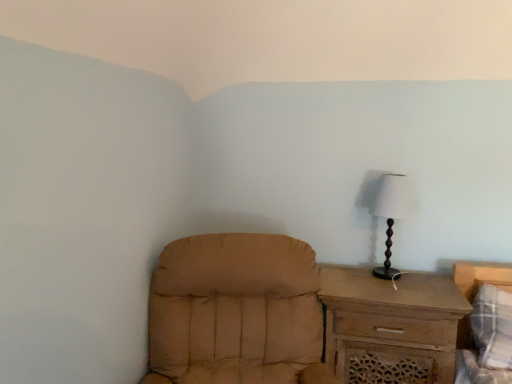
At what (x,y) coordinates should I click in order to perform the action: click on tan fabric chair at lower left. Please return your answer as a coordinate pair (x, y). Looking at the image, I should click on (236, 312).

The height and width of the screenshot is (384, 512). What do you see at coordinates (481, 276) in the screenshot?
I see `plaid fabric bed at lower right` at bounding box center [481, 276].

Identify the location of tan fabric chair at lower left. (236, 312).

Which is in front, point (384, 175) or point (475, 266)?

Point (475, 266)

Based on their positions, is white fabric lampshade at right located to the left or right of plaid fabric bed at lower right?

Based on their positions, white fabric lampshade at right is located to the left of plaid fabric bed at lower right.

Is white fabric lampshade at right touching plaid fabric bed at lower right?

No, white fabric lampshade at right is not touching plaid fabric bed at lower right.

In terms of size, does white fabric lampshade at right appear bigger or smaller than plaid fabric bed at lower right?

Considering their sizes, white fabric lampshade at right takes up less space than plaid fabric bed at lower right.

Choose the correct answer: Is brown wooden chest of drawers at right inside white fabric lampshade at right or outside it?

brown wooden chest of drawers at right is located beyond the bounds of white fabric lampshade at right.

Does brown wooden chest of drawers at right appear on the right side of white fabric lampshade at right?

Incorrect, brown wooden chest of drawers at right is not on the right side of white fabric lampshade at right.

What's the angular difference between brown wooden chest of drawers at right and white fabric lampshade at right's facing directions?

The angular difference between brown wooden chest of drawers at right and white fabric lampshade at right is 0.385 degrees.

From a real-world perspective, is brown wooden chest of drawers at right on top of white fabric lampshade at right?

No.

Is plaid fabric bed at lower right at the left side of brown wooden chest of drawers at right?

In fact, plaid fabric bed at lower right is to the right of brown wooden chest of drawers at right.

Can brown wooden chest of drawers at right be found inside plaid fabric bed at lower right?

No, brown wooden chest of drawers at right is not inside plaid fabric bed at lower right.

Which of these two, plaid fabric bed at lower right or brown wooden chest of drawers at right, is thinner?

With smaller width is plaid fabric bed at lower right.

Considering the positions of point (477, 265) and point (388, 334), is point (477, 265) closer or farther from the camera than point (388, 334)?

Point (477, 265) is positioned farther from the camera compared to point (388, 334).

At what (x,y) coordinates should I click in order to perform the action: click on chest of drawers behind the plaid fabric bed at lower right. Please return your answer as a coordinate pair (x, y). The image size is (512, 384). Looking at the image, I should click on (390, 326).

Considering the sizes of objects brown wooden chest of drawers at right and plaid fabric bed at lower right in the image provided, who is bigger, brown wooden chest of drawers at right or plaid fabric bed at lower right?

brown wooden chest of drawers at right.

Is brown wooden chest of drawers at right to the right of plaid fabric bed at lower right from the viewer's perspective?

No.

Considering the relative sizes of brown wooden chest of drawers at right and plaid fabric bed at lower right in the image provided, is brown wooden chest of drawers at right thinner than plaid fabric bed at lower right?

No.

Is brown wooden chest of drawers at right in front of or behind tan fabric chair at lower left in the image?

Visually, brown wooden chest of drawers at right is located behind tan fabric chair at lower left.

Based on the photo, from their relative heights in the image, would you say brown wooden chest of drawers at right is taller or shorter than tan fabric chair at lower left?

brown wooden chest of drawers at right is shorter than tan fabric chair at lower left.

Where is `chair that appears on the left of brown wooden chest of drawers at right`? This screenshot has height=384, width=512. chair that appears on the left of brown wooden chest of drawers at right is located at coordinates (236, 312).

Considering the relative positions of tan fabric chair at lower left and brown wooden chest of drawers at right in the image provided, is tan fabric chair at lower left in front of brown wooden chest of drawers at right?

Yes, it is in front of brown wooden chest of drawers at right.

From a real-world perspective, which is physically above, tan fabric chair at lower left or brown wooden chest of drawers at right?

tan fabric chair at lower left is physically above.

Would you say tan fabric chair at lower left contains brown wooden chest of drawers at right?

Actually, brown wooden chest of drawers at right is outside tan fabric chair at lower left.

Is tan fabric chair at lower left taller than brown wooden chest of drawers at right?

Correct, tan fabric chair at lower left is much taller as brown wooden chest of drawers at right.

Which is farther, [469,346] or [382,185]?

The point [382,185] is behind.

Is plaid fabric bed at lower right aimed at white fabric lampshade at right?

No, plaid fabric bed at lower right does not turn towards white fabric lampshade at right.

Is plaid fabric bed at lower right not inside white fabric lampshade at right?

plaid fabric bed at lower right lies outside white fabric lampshade at right's area.

Is plaid fabric bed at lower right to the left or to the right of white fabric lampshade at right in the image?

plaid fabric bed at lower right is positioned on white fabric lampshade at right's right side.

You are a GUI agent. You are given a task and a screenshot of the screen. Output one action in this format:
    pyautogui.click(x=<x>, y=<y>)
    Task: Click on the lamp located behind the plaid fabric bed at lower right
    The width and height of the screenshot is (512, 384).
    Given the screenshot: What is the action you would take?
    pyautogui.click(x=393, y=213)

This screenshot has height=384, width=512. Find the location of `lamp above the brown wooden chest of drawers at right (from the image's perspective)`. lamp above the brown wooden chest of drawers at right (from the image's perspective) is located at coordinates (393, 213).

From the image, which object appears to be nearer to white fabric lampshade at right, plaid fabric bed at lower right or tan fabric chair at lower left?

plaid fabric bed at lower right is positioned closer to the anchor white fabric lampshade at right.

Based on their spatial positions, is white fabric lampshade at right or brown wooden chest of drawers at right further from tan fabric chair at lower left?

Among the two, white fabric lampshade at right is located further to tan fabric chair at lower left.

Considering their positions, is brown wooden chest of drawers at right positioned closer to white fabric lampshade at right than plaid fabric bed at lower right?

The object closer to white fabric lampshade at right is brown wooden chest of drawers at right.

Based on their spatial positions, is white fabric lampshade at right or plaid fabric bed at lower right closer to tan fabric chair at lower left?

The object closer to tan fabric chair at lower left is white fabric lampshade at right.

When comparing their distances from tan fabric chair at lower left, does plaid fabric bed at lower right or white fabric lampshade at right seem closer?

white fabric lampshade at right is positioned closer to the anchor tan fabric chair at lower left.

From the image, which object appears to be farther from white fabric lampshade at right, plaid fabric bed at lower right or brown wooden chest of drawers at right?

plaid fabric bed at lower right is positioned further to the anchor white fabric lampshade at right.

From the image, which object appears to be farther from brown wooden chest of drawers at right, white fabric lampshade at right or tan fabric chair at lower left?

tan fabric chair at lower left is further to brown wooden chest of drawers at right.

Based on the photo, estimate the real-world distances between objects in this image. Which object is further from plaid fabric bed at lower right, white fabric lampshade at right or tan fabric chair at lower left?

tan fabric chair at lower left.

Where is `chest of drawers between tan fabric chair at lower left and white fabric lampshade at right in the front-back direction`? This screenshot has height=384, width=512. chest of drawers between tan fabric chair at lower left and white fabric lampshade at right in the front-back direction is located at coordinates (390, 326).

The height and width of the screenshot is (384, 512). Identify the location of the chest of drawers situated between tan fabric chair at lower left and plaid fabric bed at lower right from left to right. (390, 326).

You are a GUI agent. You are given a task and a screenshot of the screen. Output one action in this format:
    pyautogui.click(x=<x>, y=<y>)
    Task: Click on the lamp between tan fabric chair at lower left and plaid fabric bed at lower right
    The width and height of the screenshot is (512, 384).
    Given the screenshot: What is the action you would take?
    pyautogui.click(x=393, y=213)

What are the coordinates of `bed between white fabric lampshade at right and brown wooden chest of drawers at right from top to bottom` in the screenshot? It's located at 481,276.